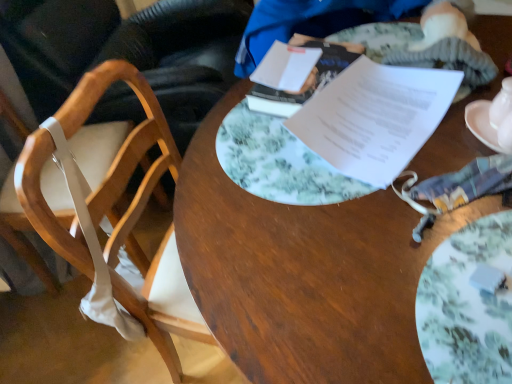
Locate an element on the screen. The image size is (512, 384). unoccupied area in front of white paper at center, which is the second journal from back to front is located at coordinates (396, 222).